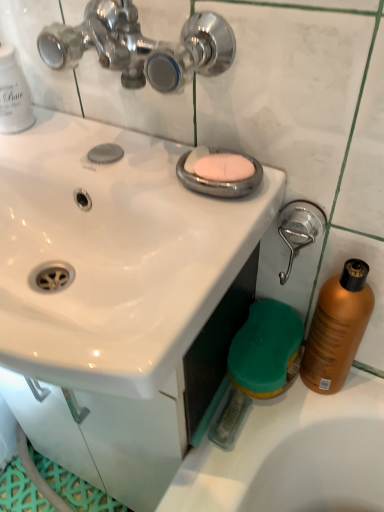
Question: Is pink matte soap at center wider than shiny orange bottle at right?

Choices:
 (A) no
 (B) yes

Answer: (A)

Question: Is pink matte soap at center aimed at shiny orange bottle at right?

Choices:
 (A) yes
 (B) no

Answer: (B)

Question: Is pink matte soap at center surrounding shiny orange bottle at right?

Choices:
 (A) no
 (B) yes

Answer: (A)

Question: Does pink matte soap at center have a smaller size compared to shiny orange bottle at right?

Choices:
 (A) no
 (B) yes

Answer: (B)

Question: Can you confirm if pink matte soap at center is positioned to the left of shiny orange bottle at right?

Choices:
 (A) yes
 (B) no

Answer: (A)

Question: Is pink matte soap at center shorter than shiny orange bottle at right?

Choices:
 (A) yes
 (B) no

Answer: (A)

Question: Can you confirm if brushed metal shower head at right is smaller than shiny orange bottle at right?

Choices:
 (A) yes
 (B) no

Answer: (A)

Question: From a real-world perspective, is brushed metal shower head at right physically below shiny orange bottle at right?

Choices:
 (A) no
 (B) yes

Answer: (A)

Question: Can you confirm if brushed metal shower head at right is bigger than shiny orange bottle at right?

Choices:
 (A) no
 (B) yes

Answer: (A)

Question: Considering the relative positions of brushed metal shower head at right and shiny orange bottle at right in the image provided, is brushed metal shower head at right behind shiny orange bottle at right?

Choices:
 (A) yes
 (B) no

Answer: (A)

Question: Is brushed metal shower head at right outside shiny orange bottle at right?

Choices:
 (A) no
 (B) yes

Answer: (B)

Question: From a real-world perspective, is brushed metal shower head at right physically above shiny orange bottle at right?

Choices:
 (A) yes
 (B) no

Answer: (A)

Question: Are shiny orange bottle at right and pink matte soap at center making contact?

Choices:
 (A) yes
 (B) no

Answer: (B)